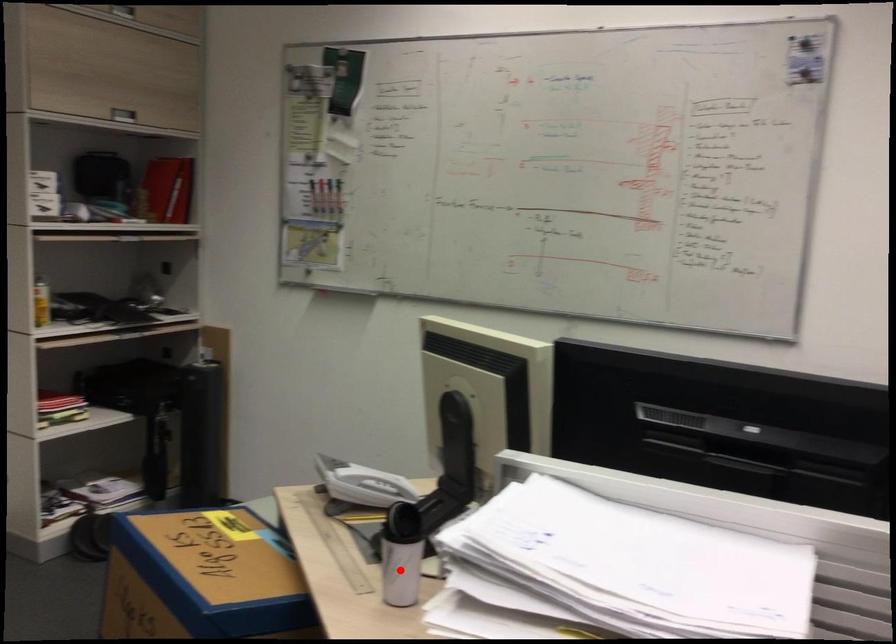
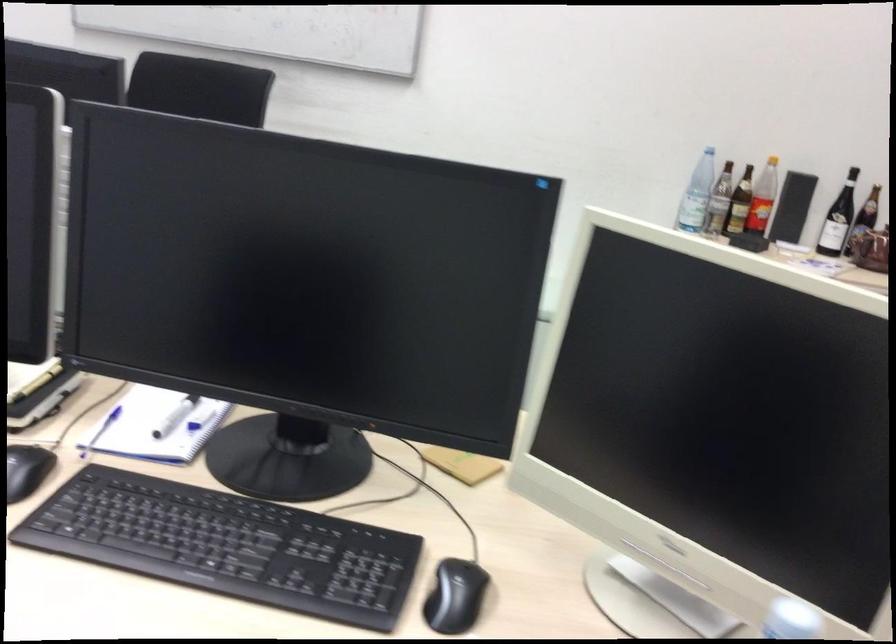
Question: I am providing you with two images of the same scene from different viewpoints. A red point is marked on the first image. Is the red point's position out of view in image 2?

Choices:
 (A) Yes
 (B) No

Answer: (A)